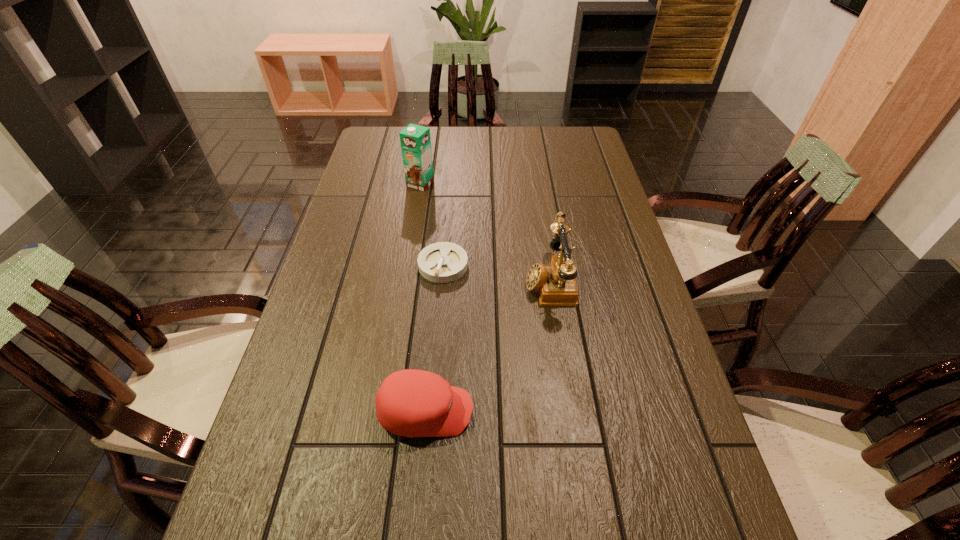
Find the location of `free location that satisfies the following two spatial constraints: 1. on the front side of the ashtray; 2. on the right side of the carton`. free location that satisfies the following two spatial constraints: 1. on the front side of the ashtray; 2. on the right side of the carton is located at coordinates (407, 265).